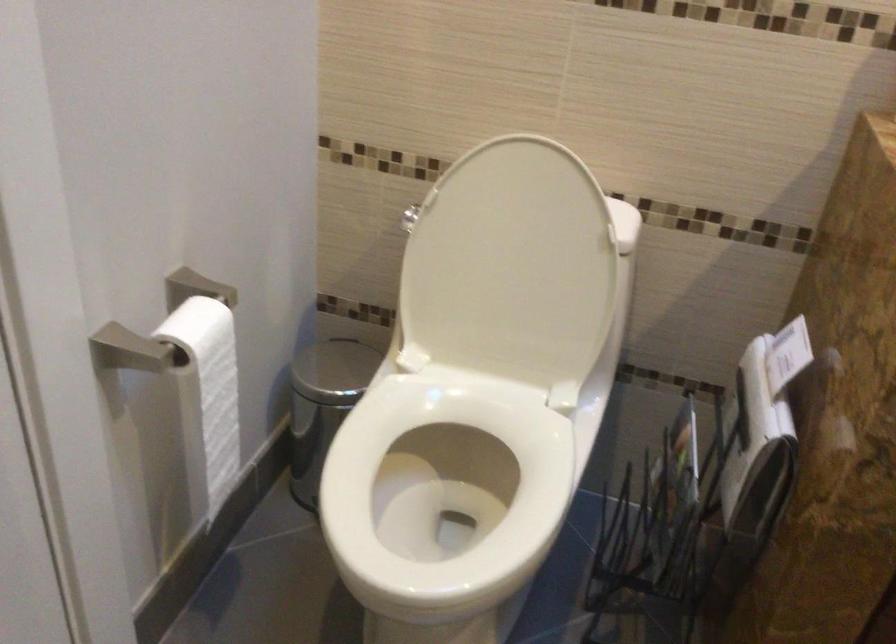
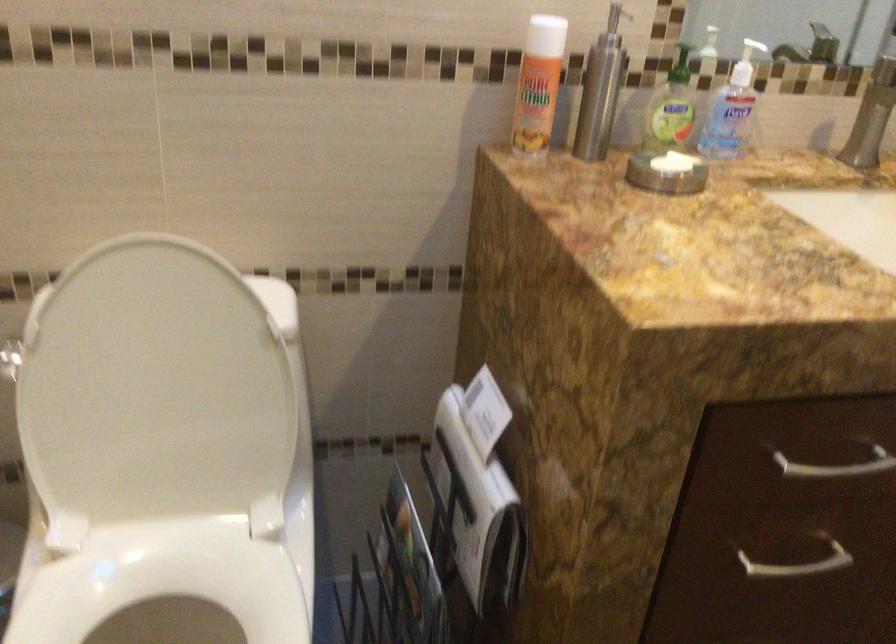
Question: In a continuous first-person perspective shot, in which direction is the camera moving?

Choices:
 (A) Left
 (B) Right
 (C) Forward
 (D) Backward

Answer: (C)